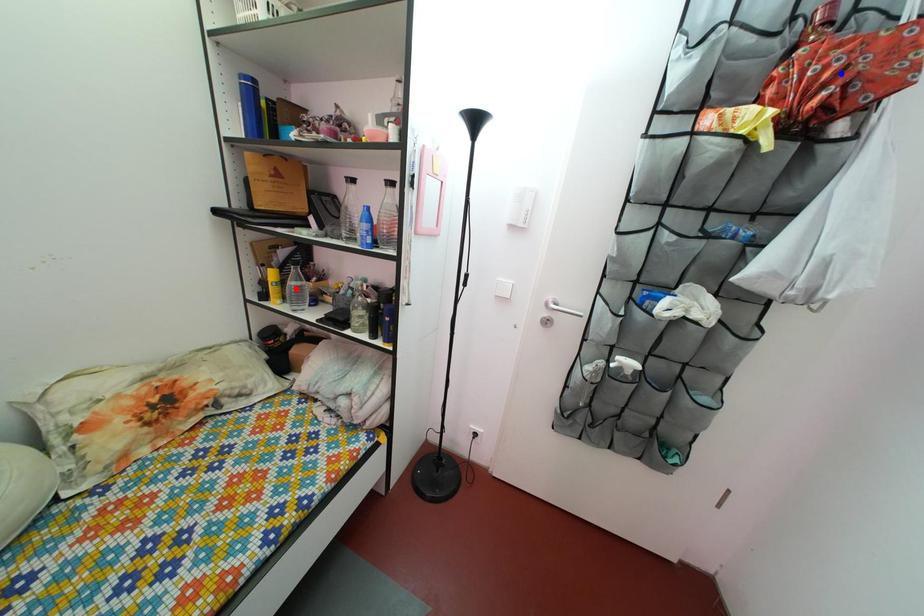
Question: Which of the two points in the image is closer to the camera?

Choices:
 (A) Blue point is closer.
 (B) Red point is closer.

Answer: (A)